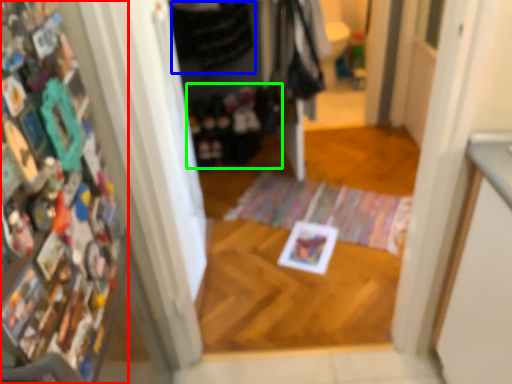
Question: Which object is positioned farthest from book (highlighted by a red box)? Select from clothing (highlighted by a blue box) and clothing (highlighted by a green box).

Choices:
 (A) clothing
 (B) clothing

Answer: (B)